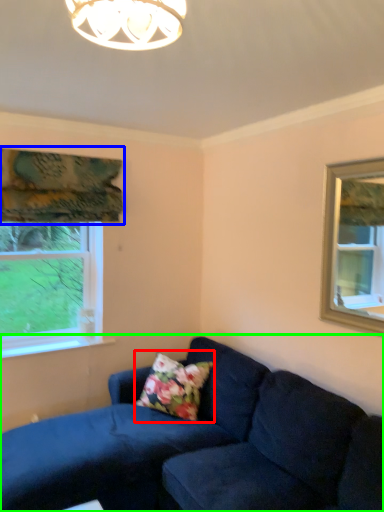
Question: Which is farther away from pillow (highlighted by a red box)? curtain (highlighted by a blue box) or studio couch (highlighted by a green box)?

Choices:
 (A) curtain
 (B) studio couch

Answer: (A)